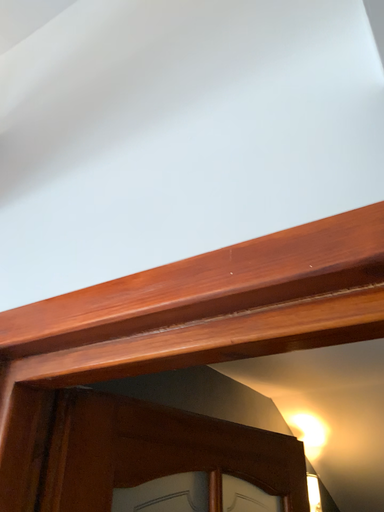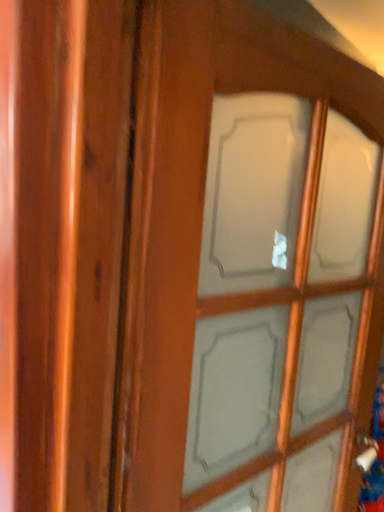
Question: Which way did the camera rotate in the video?

Choices:
 (A) rotated upward
 (B) rotated downward

Answer: (B)